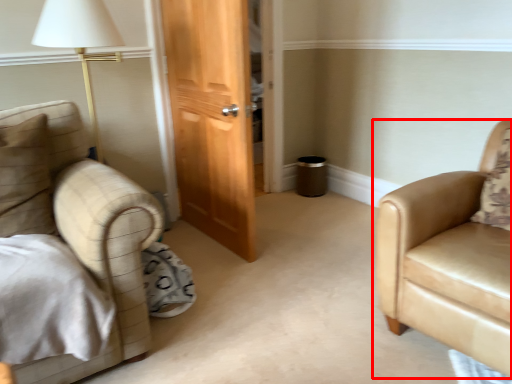
Question: Where is chair (annotated by the red box) located in relation to pillow in the image?

Choices:
 (A) left
 (B) right

Answer: (B)